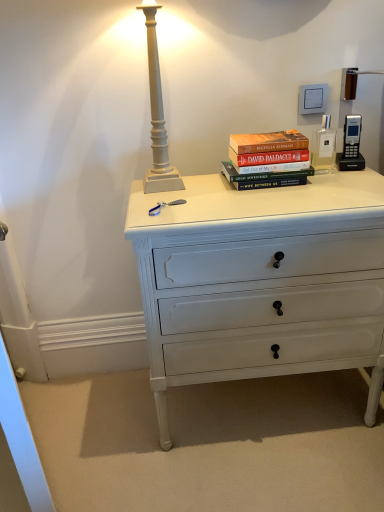
Question: Visually, is white painted wood chest of drawers at center positioned to the left or to the right of hardcover books at center?

Choices:
 (A) left
 (B) right

Answer: (B)

Question: Choose the correct answer: Is white painted wood chest of drawers at center inside hardcover books at center or outside it?

Choices:
 (A) outside
 (B) inside

Answer: (A)

Question: In terms of height, does white painted wood chest of drawers at center look taller or shorter compared to hardcover books at center?

Choices:
 (A) short
 (B) tall

Answer: (B)

Question: Visually, is hardcover books at center positioned to the left or to the right of white painted wood chest of drawers at center?

Choices:
 (A) left
 (B) right

Answer: (A)

Question: In terms of width, does hardcover books at center look wider or thinner when compared to white painted wood chest of drawers at center?

Choices:
 (A) wide
 (B) thin

Answer: (B)

Question: Is hardcover books at center situated inside white painted wood chest of drawers at center or outside?

Choices:
 (A) outside
 (B) inside

Answer: (A)

Question: Is point (302, 137) closer or farther from the camera than point (187, 227)?

Choices:
 (A) farther
 (B) closer

Answer: (A)